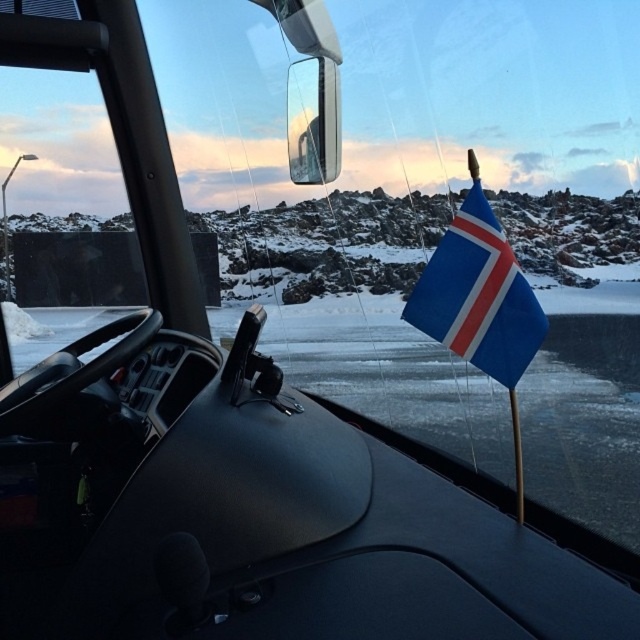
You are a passenger in the vehicle and want to reach the point marked as point (534, 328) outside the vehicle. The vehicle has a door on the driver side which is on your left. Considering the distance between you and the point, can you step out of the door and reach the point without walking further than 5 feet?

The point (534, 328) is 5.00 feet away from the viewer. Since the maximum walking distance allowed is 5 feet, you can step out of the door and reach the point without walking further than 5 feet.

You are driving a vehicle and need to attach a GPS tracker to either the blue fabric flag at center or the glossy plastic view mirror at upper center. The GPS tracker requires a minimum of 5 feet of space between it and any other object to function properly. Based on the scene described, which object can you safely attach the GPS tracker to?

The blue fabric flag at center is 6.08 feet away from the glossy plastic view mirror at upper center. Since the GPS tracker needs at least 5 feet of space, attaching it to either object would work because the distance between them is sufficient. However, since the question asks for which object can be safely attached, both are possible, but the flag is the only one mentioned in the objects. Wait, no, the objects are both. Hmm, the answer should state that both can be used since the distance between them is